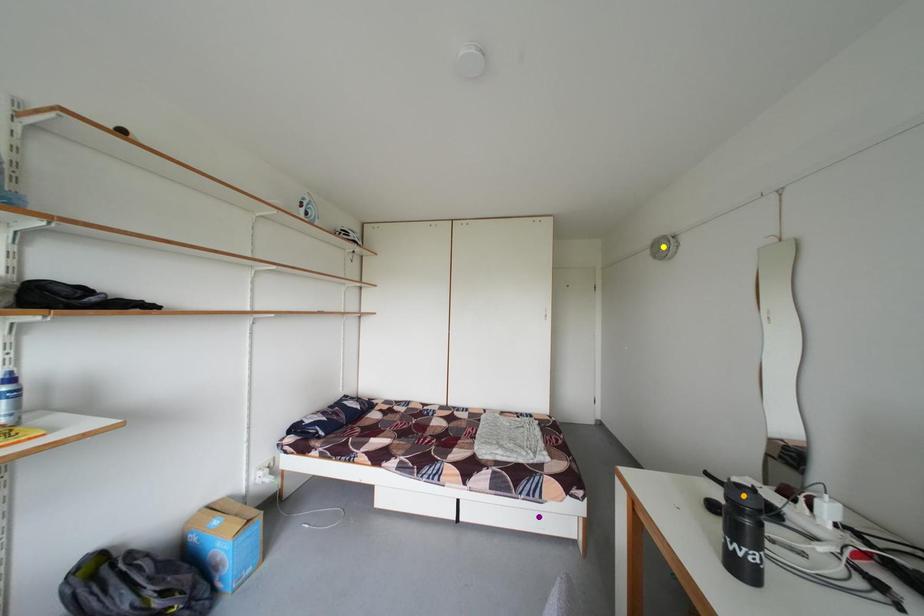
From the picture: Order these from nearest to farthest:
A) yellow point
B) purple point
C) orange point

orange point → purple point → yellow point